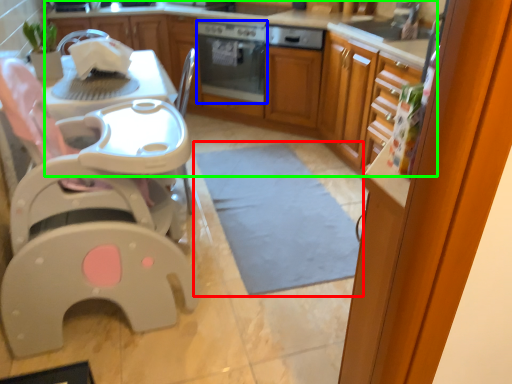
Question: Considering the real-world distances, which object is closest to mat (highlighted by a red box)? home appliance (highlighted by a blue box) or cabinetry (highlighted by a green box).

Choices:
 (A) home appliance
 (B) cabinetry

Answer: (B)